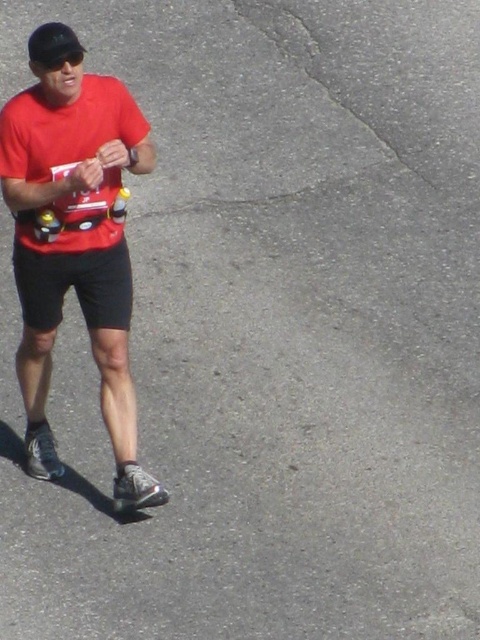
Which is above, black cotton shorts at center or black matte baseball hat at upper left?

black matte baseball hat at upper left

Who is taller, black cotton shorts at center or black matte baseball hat at upper left?

Standing taller between the two is black cotton shorts at center.

Which is behind, point (115, 292) or point (70, 52)?

Point (115, 292)

Where is `black cotton shorts at center`? The width and height of the screenshot is (480, 640). black cotton shorts at center is located at coordinates (74, 285).

Does matte red shirt at left appear on the right side of black cotton shorts at center?

Correct, you'll find matte red shirt at left to the right of black cotton shorts at center.

Between point (110, 198) and point (24, 296), which one is positioned in front?

Positioned in front is point (110, 198).

Between point (116, 244) and point (95, 317), which one is positioned in front?

Positioned in front is point (116, 244).

Locate an element on the screen. Image resolution: width=480 pixels, height=640 pixels. matte red shirt at left is located at coordinates (75, 250).

Does matte red shirt at left have a larger size compared to black matte baseball hat at upper left?

Correct, matte red shirt at left is larger in size than black matte baseball hat at upper left.

Is point (58, 289) in front of point (75, 58)?

No, it is not.

At what (x,y) coordinates should I click in order to perform the action: click on matte red shirt at left. Please return your answer as a coordinate pair (x, y). Image resolution: width=480 pixels, height=640 pixels. Looking at the image, I should click on (75, 250).